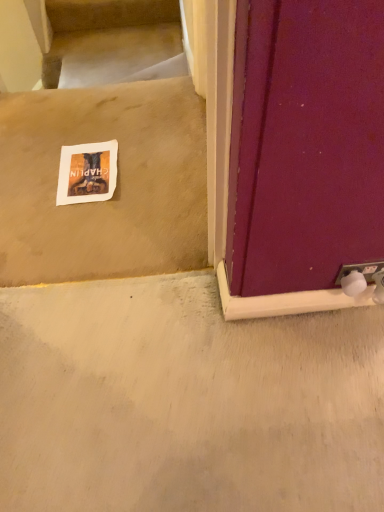
Question: From a real-world perspective, relative to white paper at center, is beige carpet at upper left vertically above or below?

Choices:
 (A) below
 (B) above

Answer: (A)

Question: Is beige carpet at upper left situated inside white paper at center or outside?

Choices:
 (A) outside
 (B) inside

Answer: (A)

Question: Would you say beige carpet at upper left is to the left or to the right of white paper at center in the picture?

Choices:
 (A) right
 (B) left

Answer: (B)

Question: Visually, is white paper at center positioned to the left or to the right of beige carpet at upper left?

Choices:
 (A) right
 (B) left

Answer: (A)

Question: Is point (77, 188) positioned closer to the camera than point (61, 48)?

Choices:
 (A) farther
 (B) closer

Answer: (B)

Question: Is white paper at center bigger or smaller than beige carpet at upper left?

Choices:
 (A) big
 (B) small

Answer: (B)

Question: From a real-world perspective, is white paper at center positioned above or below beige carpet at upper left?

Choices:
 (A) above
 (B) below

Answer: (A)